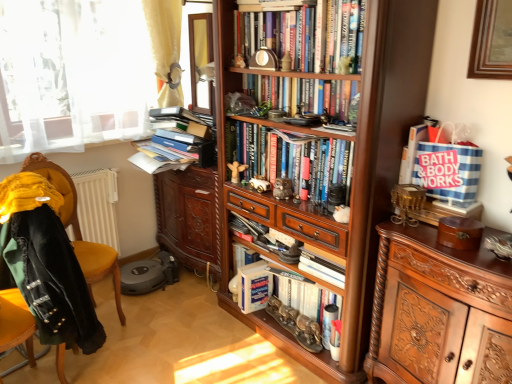
Question: Is hardcover books at center, marked as the 4th book in a bottom-to-top arrangement, outside polished wood cabinet at right?

Choices:
 (A) yes
 (B) no

Answer: (A)

Question: Is hardcover books at center, marked as the 4th book in a bottom-to-top arrangement, shorter than polished wood cabinet at right?

Choices:
 (A) no
 (B) yes

Answer: (B)

Question: Can you confirm if hardcover books at center, marked as the 4th book in a bottom-to-top arrangement, is positioned to the left of polished wood cabinet at right?

Choices:
 (A) yes
 (B) no

Answer: (A)

Question: From the image's perspective, is hardcover books at center, marked as the 4th book in a bottom-to-top arrangement, over polished wood cabinet at right?

Choices:
 (A) yes
 (B) no

Answer: (A)

Question: Is hardcover books at center, the second book viewed from the top, positioned behind polished wood cabinet at right?

Choices:
 (A) no
 (B) yes

Answer: (B)

Question: Is point (292, 319) closer or farther from the camera than point (261, 278)?

Choices:
 (A) closer
 (B) farther

Answer: (A)

Question: From the image's perspective, is metallic silver magazine at center located above or below white matte paperback book at center?

Choices:
 (A) below
 (B) above

Answer: (A)

Question: Is metallic silver magazine at center wider or thinner than white matte paperback book at center?

Choices:
 (A) wide
 (B) thin

Answer: (B)

Question: Is metallic silver magazine at center bigger or smaller than white matte paperback book at center?

Choices:
 (A) small
 (B) big

Answer: (A)

Question: Is metallic silver magazine at center bigger or smaller than polished wood cabinet at right?

Choices:
 (A) small
 (B) big

Answer: (A)

Question: From the image's perspective, is metallic silver magazine at center positioned above or below polished wood cabinet at right?

Choices:
 (A) above
 (B) below

Answer: (B)

Question: From a real-world perspective, is metallic silver magazine at center positioned above or below polished wood cabinet at right?

Choices:
 (A) above
 (B) below

Answer: (B)

Question: Is point (307, 279) closer or farther from the camera than point (424, 258)?

Choices:
 (A) farther
 (B) closer

Answer: (A)

Question: Visually, is blue striped tote bag at upper right, the second book in the bottom-to-top sequence, positioned to the left or to the right of matte brown owl at center, the 1th toy positioned from the front?

Choices:
 (A) right
 (B) left

Answer: (A)

Question: Considering the positions of blue striped tote bag at upper right, the 4th book from the top, and matte brown owl at center, which is counted as the 1th toy, starting from the right, in the image, is blue striped tote bag at upper right, the 4th book from the top, wider or thinner than matte brown owl at center, which is counted as the 1th toy, starting from the right,?

Choices:
 (A) thin
 (B) wide

Answer: (B)